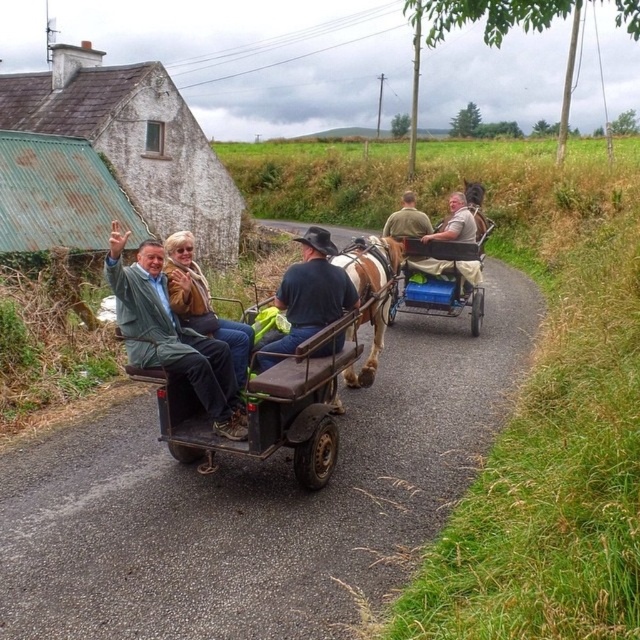
You are a photographer standing on the side of the road. You notice the green fabric jacket at center and the brown glossy horse at center in the scene. Which object appears narrower in width?

The green fabric jacket at center is thinner than the brown glossy horse at center, so the green fabric jacket at center appears narrower in width.

You are a photographer standing on the side of the road. You notice the green fabric jacket at center and the brown glossy horse at center in the scene. Which object is closer to the ground?

The green fabric jacket at center is shorter than the brown glossy horse at center, so it is closer to the ground.

You are standing at the point marked by the coordinates point [170,333] in the image. Looking around, you notice a green fabric jacket at center. Which direction should you move to find the driver of the first carriage?

The driver of the first carriage is located behind the green fabric jacket at center. Since the point [170,333] marks the green fabric jacket at center, you should move backward to reach the driver.